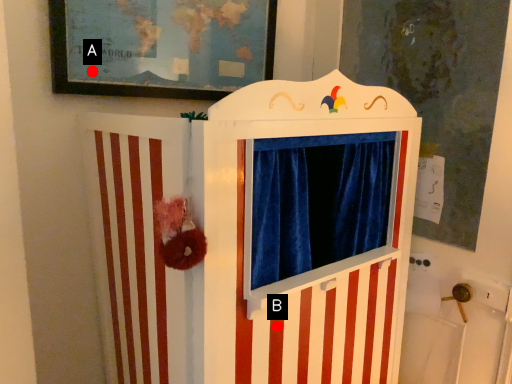
Question: Two points are circled on the image, labeled by A and B beside each circle. Which point is farther from the camera taking this photo?

Choices:
 (A) A is further
 (B) B is further

Answer: (A)